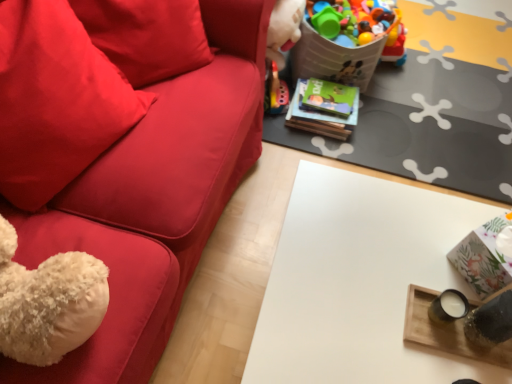
Question: Is white glossy table at center surrounding velvety red pillow at left?

Choices:
 (A) yes
 (B) no

Answer: (B)

Question: Can you confirm if white glossy table at center is wider than velvety red pillow at left?

Choices:
 (A) yes
 (B) no

Answer: (A)

Question: Can you confirm if white glossy table at center is bigger than velvety red pillow at left?

Choices:
 (A) yes
 (B) no

Answer: (A)

Question: Is white glossy table at center beside velvety red pillow at left?

Choices:
 (A) yes
 (B) no

Answer: (B)

Question: From the image's perspective, would you say white glossy table at center is shown under velvety red pillow at left?

Choices:
 (A) no
 (B) yes

Answer: (B)

Question: From a real-world perspective, is white glossy table at center over velvety red pillow at left?

Choices:
 (A) no
 (B) yes

Answer: (A)

Question: Does velvety red pillow at left have a greater height compared to white glossy table at center?

Choices:
 (A) no
 (B) yes

Answer: (A)

Question: Can we say velvety red pillow at left lies outside white glossy table at center?

Choices:
 (A) yes
 (B) no

Answer: (A)

Question: From the image's perspective, is velvety red pillow at left beneath white glossy table at center?

Choices:
 (A) no
 (B) yes

Answer: (A)

Question: Does velvety red pillow at left lie in front of white glossy table at center?

Choices:
 (A) no
 (B) yes

Answer: (B)

Question: Considering the relative sizes of velvety red pillow at left and white glossy table at center in the image provided, is velvety red pillow at left wider than white glossy table at center?

Choices:
 (A) yes
 (B) no

Answer: (B)

Question: Can you confirm if velvety red pillow at left is thinner than white glossy table at center?

Choices:
 (A) no
 (B) yes

Answer: (B)

Question: Would you say velvety red pillow at left is to the left or to the right of white glossy table at center in the picture?

Choices:
 (A) left
 (B) right

Answer: (A)